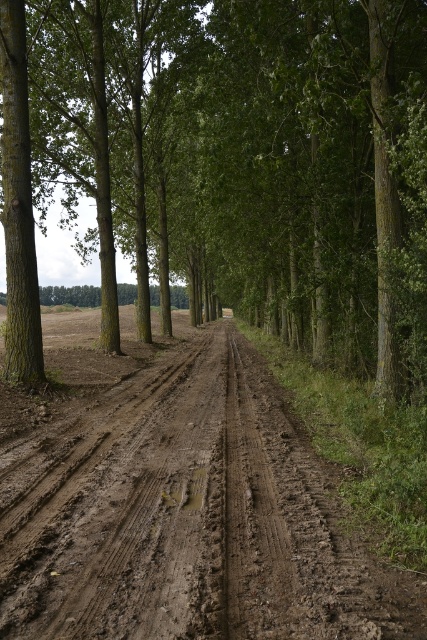
Question: Among these points, which one is nearest to the camera?

Choices:
 (A) (49, 321)
 (B) (360, 323)

Answer: (B)

Question: Does brown rough tree at center appear over brown muddy dirt track at center?

Choices:
 (A) yes
 (B) no

Answer: (A)

Question: Which point is farther to the camera?

Choices:
 (A) (380, 205)
 (B) (38, 531)

Answer: (A)

Question: In this image, where is brown rough tree at center located relative to brown muddy dirt track at center?

Choices:
 (A) below
 (B) above

Answer: (B)

Question: Can you confirm if brown rough tree at center is smaller than brown muddy dirt track at center?

Choices:
 (A) yes
 (B) no

Answer: (B)